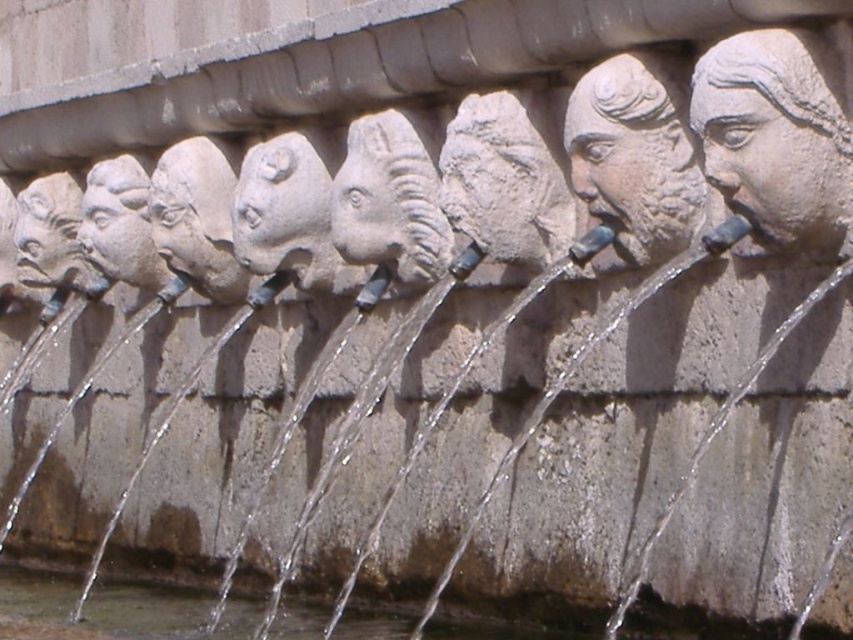
You are standing in front of the fountain and want to know which of the two faces, the stone textured face at center or the matte stone face at center, is shorter. Can you determine this based on their positions?

The stone textured face at center is not as tall as the matte stone face at center, so the stone textured face at center is shorter.

You are an architect designing a new fountain and want to ensure proper water flow between the stone textured face at center and the matte stone horse head at center. Which object is shorter and thus might require adjusting the water pressure to avoid overflow?

The stone textured face at center is not as tall as the matte stone horse head at center, so it might require adjusting the water pressure to avoid overflow since it is shorter.

You are designing a new water feature and want to ensure proper water flow between the stone textured face at center and the matte stone horse head at center. Which object should you adjust to allow more water to pass through without obstructing the flow?

The stone textured face at center has a lesser width compared to matte stone horse head at center. To allow more water to pass through, you should adjust the stone textured face at center by increasing its width to match or exceed that of the matte stone horse head at center.